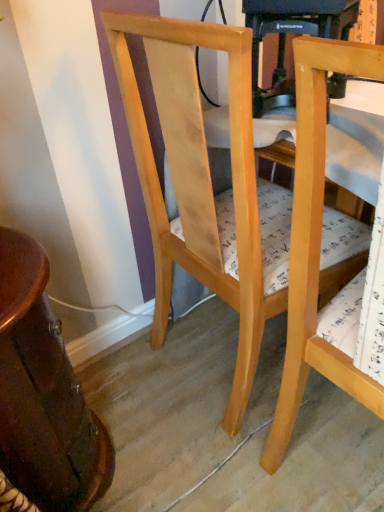
Question: Can you see natural wood chair at right, the first chair viewed from the right, touching wooden table at left?

Choices:
 (A) no
 (B) yes

Answer: (A)

Question: From a real-world perspective, is natural wood chair at right, acting as the second chair starting from the left, positioned over wooden table at left based on gravity?

Choices:
 (A) yes
 (B) no

Answer: (A)

Question: Considering the relative sizes of natural wood chair at right, the first chair viewed from the right, and wooden table at left in the image provided, is natural wood chair at right, the first chair viewed from the right, shorter than wooden table at left?

Choices:
 (A) yes
 (B) no

Answer: (B)

Question: Could you tell me if natural wood chair at right, acting as the second chair starting from the left, is turned towards wooden table at left?

Choices:
 (A) no
 (B) yes

Answer: (A)

Question: Is natural wood chair at right, acting as the second chair starting from the left, at the left side of wooden table at left?

Choices:
 (A) no
 (B) yes

Answer: (A)

Question: From the image's perspective, is natural wood chair at right, acting as the second chair starting from the left, positioned above or below light wood chair at center, which is the second chair in right-to-left order?

Choices:
 (A) below
 (B) above

Answer: (A)

Question: Is natural wood chair at right, the first chair viewed from the right, taller or shorter than light wood chair at center, which is the 1th chair in left-to-right order?

Choices:
 (A) tall
 (B) short

Answer: (A)

Question: Does point (380, 411) appear closer or farther from the camera than point (200, 28)?

Choices:
 (A) farther
 (B) closer

Answer: (A)

Question: Choose the correct answer: Is natural wood chair at right, the first chair viewed from the right, inside light wood chair at center, which is the 1th chair in left-to-right order, or outside it?

Choices:
 (A) inside
 (B) outside

Answer: (B)

Question: Is point (243, 343) closer or farther from the camera than point (291, 372)?

Choices:
 (A) farther
 (B) closer

Answer: (A)

Question: Is light wood chair at center, which is the second chair in right-to-left order, spatially inside natural wood chair at right, the first chair viewed from the right, or outside of it?

Choices:
 (A) outside
 (B) inside

Answer: (A)

Question: Is light wood chair at center, which is the second chair in right-to-left order, bigger or smaller than natural wood chair at right, the first chair viewed from the right?

Choices:
 (A) big
 (B) small

Answer: (A)

Question: Would you say light wood chair at center, which is the second chair in right-to-left order, is to the left or to the right of natural wood chair at right, acting as the second chair starting from the left, in the picture?

Choices:
 (A) left
 (B) right

Answer: (A)

Question: Is light wood chair at center, which is the second chair in right-to-left order, taller or shorter than wooden table at left?

Choices:
 (A) tall
 (B) short

Answer: (A)

Question: From a real-world perspective, relative to wooden table at left, is light wood chair at center, which is the 1th chair in left-to-right order, vertically above or below?

Choices:
 (A) above
 (B) below

Answer: (A)